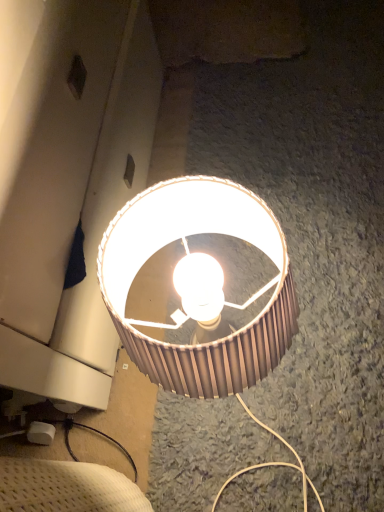
Identify the location of matte brown lampshade at center. (189, 310).

The image size is (384, 512). Describe the element at coordinates (189, 310) in the screenshot. I see `matte brown lampshade at center` at that location.

This screenshot has width=384, height=512. I want to click on matte brown lampshade at center, so click(x=189, y=310).